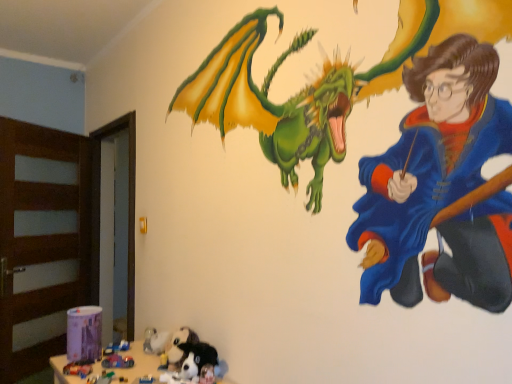
The width and height of the screenshot is (512, 384). Describe the element at coordinates (178, 348) in the screenshot. I see `soft plush dog at lower center, which is the second animal from front to back` at that location.

At what (x,y) coordinates should I click in order to perform the action: click on soft plush dog at lower center, which is the second animal from front to back. Please return your answer as a coordinate pair (x, y). This screenshot has height=384, width=512. Looking at the image, I should click on (178, 348).

Measure the distance between point (118, 347) and camera.

They are 2.04 meters apart.

What do you see at coordinates (117, 361) in the screenshot? This screenshot has height=384, width=512. I see `shiny plastic toy car at lower left, the 2th toy when ordered from back to front` at bounding box center [117, 361].

This screenshot has width=512, height=384. Find the location of `plastic toy car at lower left, the third toy from the back`. plastic toy car at lower left, the third toy from the back is located at coordinates (79, 368).

From the image's perspective, is plastic toy car at lower left, which is the first toy from front to back, above or below soft plush dog at lower center, marked as the first animal in a front-to-back arrangement?

From the image's perspective, plastic toy car at lower left, which is the first toy from front to back, appears below soft plush dog at lower center, marked as the first animal in a front-to-back arrangement.

Is the depth of plastic toy car at lower left, which is the first toy from front to back, greater than that of soft plush dog at lower center, marked as the first animal in a front-to-back arrangement?

Yes.

From the picture: How different are the orientations of plastic toy car at lower left, the third toy from the back, and soft plush dog at lower center, the second animal when ordered from back to front, in degrees?

29.9 degrees separate the facing orientations of plastic toy car at lower left, the third toy from the back, and soft plush dog at lower center, the second animal when ordered from back to front.

Which point is more distant from viewer, (187, 333) or (116, 365)?

The point (187, 333) is farther from the camera.

From a real-world perspective, does soft plush dog at lower center, placed as the first animal when sorted from back to front, stand above shiny plastic toy car at lower left, the 2th toy when ordered from back to front?

Yes.

From the image's perspective, relative to shiny plastic toy car at lower left, which is the second toy in front-to-back order, is soft plush dog at lower center, placed as the first animal when sorted from back to front, above or below?

From the image's perspective, soft plush dog at lower center, placed as the first animal when sorted from back to front, appears above shiny plastic toy car at lower left, which is the second toy in front-to-back order.

Would you say plastic toy car at lower left, the third toy from the back, is outside plastic toy car at lower left, which is counted as the 1th toy, starting from the back?

Yes, plastic toy car at lower left, the third toy from the back, is located beyond the bounds of plastic toy car at lower left, which is counted as the 1th toy, starting from the back.

In the image, is plastic toy car at lower left, the third toy from the back, positioned in front of or behind plastic toy car at lower left, which ranks as the 3th toy in front-to-back order?

plastic toy car at lower left, the third toy from the back, is in front of plastic toy car at lower left, which ranks as the 3th toy in front-to-back order.

Considering the sizes of objects plastic toy car at lower left, the third toy from the back, and plastic toy car at lower left, which ranks as the 3th toy in front-to-back order, in the image provided, who is shorter, plastic toy car at lower left, the third toy from the back, or plastic toy car at lower left, which ranks as the 3th toy in front-to-back order,?

plastic toy car at lower left, the third toy from the back.

Looking at this image, considering the relative positions of plastic toy car at lower left, which ranks as the 3th toy in front-to-back order, and soft plush dog at lower center, placed as the first animal when sorted from back to front, in the image provided, is plastic toy car at lower left, which ranks as the 3th toy in front-to-back order, behind soft plush dog at lower center, placed as the first animal when sorted from back to front,?

That is True.

Is plastic toy car at lower left, which is counted as the 1th toy, starting from the back, positioned with its back to soft plush dog at lower center, placed as the first animal when sorted from back to front?

No.

Considering the relative sizes of plastic toy car at lower left, which is counted as the 1th toy, starting from the back, and soft plush dog at lower center, placed as the first animal when sorted from back to front, in the image provided, is plastic toy car at lower left, which is counted as the 1th toy, starting from the back, wider than soft plush dog at lower center, placed as the first animal when sorted from back to front,?

In fact, plastic toy car at lower left, which is counted as the 1th toy, starting from the back, might be narrower than soft plush dog at lower center, placed as the first animal when sorted from back to front.

Considering the positions of objects plastic toy car at lower left, which is counted as the 1th toy, starting from the back, and soft plush dog at lower center, which is the second animal from front to back, in the image provided, who is more to the left, plastic toy car at lower left, which is counted as the 1th toy, starting from the back, or soft plush dog at lower center, which is the second animal from front to back,?

Positioned to the left is plastic toy car at lower left, which is counted as the 1th toy, starting from the back.

Between shiny plastic toy car at lower left, the 2th toy when ordered from back to front, and soft plush dog at lower center, which is the second animal from front to back, which one is positioned in front?

Positioned in front is soft plush dog at lower center, which is the second animal from front to back.

Does point (103, 367) come farther from viewer compared to point (186, 354)?

Yes.

From the image's perspective, is shiny plastic toy car at lower left, which is the second toy in front-to-back order, positioned above or below soft plush dog at lower center, placed as the first animal when sorted from back to front?

Based on their image positions, shiny plastic toy car at lower left, which is the second toy in front-to-back order, is located beneath soft plush dog at lower center, placed as the first animal when sorted from back to front.

From a real-world perspective, does shiny plastic toy car at lower left, which is the second toy in front-to-back order, stand above soft plush dog at lower center, placed as the first animal when sorted from back to front?

No, from a real-world perspective, shiny plastic toy car at lower left, which is the second toy in front-to-back order, is not above soft plush dog at lower center, placed as the first animal when sorted from back to front.

Considering the sizes of objects plastic toy car at lower left, which is counted as the 1th toy, starting from the back, and shiny plastic toy car at lower left, which is the second toy in front-to-back order, in the image provided, who is wider, plastic toy car at lower left, which is counted as the 1th toy, starting from the back, or shiny plastic toy car at lower left, which is the second toy in front-to-back order,?

Wider between the two is shiny plastic toy car at lower left, which is the second toy in front-to-back order.

Based on their sizes in the image, would you say plastic toy car at lower left, which is counted as the 1th toy, starting from the back, is bigger or smaller than shiny plastic toy car at lower left, the 2th toy when ordered from back to front?

In the image, plastic toy car at lower left, which is counted as the 1th toy, starting from the back, appears to be smaller than shiny plastic toy car at lower left, the 2th toy when ordered from back to front.

Can you confirm if plastic toy car at lower left, which is counted as the 1th toy, starting from the back, is taller than shiny plastic toy car at lower left, which is the second toy in front-to-back order?

No.

From a real-world perspective, is plastic toy car at lower left, which ranks as the 3th toy in front-to-back order, positioned above or below shiny plastic toy car at lower left, which is the second toy in front-to-back order?

From a real-world perspective, plastic toy car at lower left, which ranks as the 3th toy in front-to-back order, is physically below shiny plastic toy car at lower left, which is the second toy in front-to-back order.

Is the depth of plastic toy car at lower left, which is counted as the 1th toy, starting from the back, less than that of plastic toy car at lower left, the third toy from the back?

No.

Is plastic toy car at lower left, which ranks as the 3th toy in front-to-back order, oriented towards plastic toy car at lower left, the third toy from the back?

No, plastic toy car at lower left, which ranks as the 3th toy in front-to-back order, is not oriented towards plastic toy car at lower left, the third toy from the back.

Starting from the plastic toy car at lower left, which is counted as the 1th toy, starting from the back, which toy is the 2nd one in front? Please provide its 2D coordinates.

[(79, 368)]

The height and width of the screenshot is (384, 512). I want to click on the 2nd toy below the soft plush dog at lower center, the second animal when ordered from back to front (from a real-world perspective), so click(79, 368).

Image resolution: width=512 pixels, height=384 pixels. I want to click on animal that is the 1st object located in front of the shiny plastic toy car at lower left, which is the second toy in front-to-back order, so click(x=178, y=348).

Based on their spatial positions, is soft plush dog at lower center, which is the second animal from front to back, or shiny plastic toy car at lower left, which is the second toy in front-to-back order, closer to plastic toy car at lower left, which ranks as the 3th toy in front-to-back order?

shiny plastic toy car at lower left, which is the second toy in front-to-back order, lies closer to plastic toy car at lower left, which ranks as the 3th toy in front-to-back order, than the other object.

Looking at the image, which one is located further to soft plush dog at lower center, marked as the first animal in a front-to-back arrangement, shiny plastic toy car at lower left, which is the second toy in front-to-back order, or soft plush dog at lower center, which is the second animal from front to back?

shiny plastic toy car at lower left, which is the second toy in front-to-back order.

Which object lies nearer to the anchor point shiny plastic toy car at lower left, the 2th toy when ordered from back to front, soft plush dog at lower center, the second animal when ordered from back to front, or soft plush dog at lower center, placed as the first animal when sorted from back to front?

soft plush dog at lower center, placed as the first animal when sorted from back to front.

Which object lies nearer to the anchor point soft plush dog at lower center, which is the second animal from front to back, soft plush dog at lower center, marked as the first animal in a front-to-back arrangement, or plastic toy car at lower left, which is the first toy from front to back?

soft plush dog at lower center, marked as the first animal in a front-to-back arrangement.

Based on their spatial positions, is soft plush dog at lower center, placed as the first animal when sorted from back to front, or plastic toy car at lower left, the third toy from the back, closer to shiny plastic toy car at lower left, the 2th toy when ordered from back to front?

plastic toy car at lower left, the third toy from the back, is closer to shiny plastic toy car at lower left, the 2th toy when ordered from back to front.

Which object lies nearer to the anchor point soft plush dog at lower center, which is the second animal from front to back, plastic toy car at lower left, which is counted as the 1th toy, starting from the back, or plastic toy car at lower left, the third toy from the back?

plastic toy car at lower left, which is counted as the 1th toy, starting from the back, is positioned closer to the anchor soft plush dog at lower center, which is the second animal from front to back.

Based on their spatial positions, is plastic toy car at lower left, the third toy from the back, or soft plush dog at lower center, the second animal when ordered from back to front, closer to shiny plastic toy car at lower left, the 2th toy when ordered from back to front?

plastic toy car at lower left, the third toy from the back, lies closer to shiny plastic toy car at lower left, the 2th toy when ordered from back to front, than the other object.

Looking at the image, which one is located further to soft plush dog at lower center, the second animal when ordered from back to front, plastic toy car at lower left, which ranks as the 3th toy in front-to-back order, or soft plush dog at lower center, placed as the first animal when sorted from back to front?

plastic toy car at lower left, which ranks as the 3th toy in front-to-back order, lies further to soft plush dog at lower center, the second animal when ordered from back to front, than the other object.

Find the location of a particular element. The height and width of the screenshot is (384, 512). toy between plastic toy car at lower left, the third toy from the back, and plastic toy car at lower left, which ranks as the 3th toy in front-to-back order, along the z-axis is located at coordinates (117, 361).

Locate an element on the screen. The width and height of the screenshot is (512, 384). animal between plastic toy car at lower left, which is the first toy from front to back, and soft plush dog at lower center, the second animal when ordered from back to front, in the horizontal direction is located at coordinates (178, 348).

I want to click on toy situated between plastic toy car at lower left, which is counted as the 1th toy, starting from the back, and soft plush dog at lower center, placed as the first animal when sorted from back to front, from left to right, so click(117, 361).

Identify the location of animal between shiny plastic toy car at lower left, the 2th toy when ordered from back to front, and soft plush dog at lower center, the second animal when ordered from back to front, in the horizontal direction. This screenshot has width=512, height=384. (178, 348).